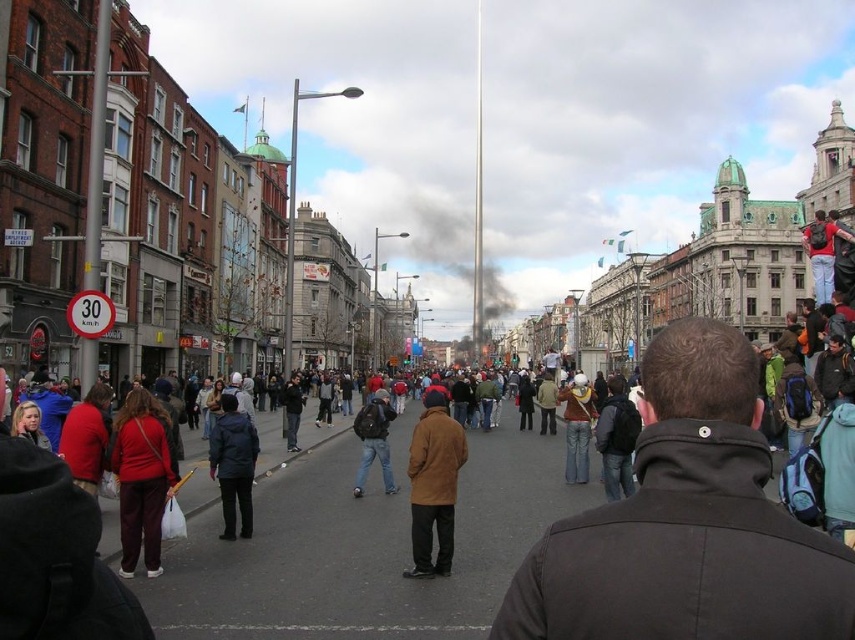
Does matte black backpack at center have a larger size compared to red backpack at center?

Incorrect, matte black backpack at center is not larger than red backpack at center.

From the picture: Does matte black backpack at center come in front of red backpack at center?

Yes, it is in front of red backpack at center.

Does point (385, 476) lie behind point (828, 244)?

No, it is not.

You are a GUI agent. You are given a task and a screenshot of the screen. Output one action in this format:
    pyautogui.click(x=<x>, y=<y>)
    Task: Click on the matte black backpack at center
    
    Given the screenshot: What is the action you would take?
    pyautogui.click(x=374, y=440)

Is point (411, 468) positioned in front of point (286, 435)?

That is True.

Is brown woolen coat at center thinner than dark brown leather jacket at center?

Correct, brown woolen coat at center's width is less than dark brown leather jacket at center's.

At what (x,y) coordinates should I click in order to perform the action: click on brown woolen coat at center. Please return your answer as a coordinate pair (x, y). Looking at the image, I should click on click(433, 484).

Locate an element on the screen. The image size is (855, 640). brown woolen coat at center is located at coordinates (433, 484).

Locate an element on the screen. The image size is (855, 640). matte black backpack at center is located at coordinates (374, 440).

Which is behind, point (374, 449) or point (293, 417)?

The point (293, 417) is behind.

Does point (379, 448) lie behind point (287, 419)?

No, it is in front of (287, 419).

Find the location of a particular element. This screenshot has width=855, height=640. matte black backpack at center is located at coordinates (374, 440).